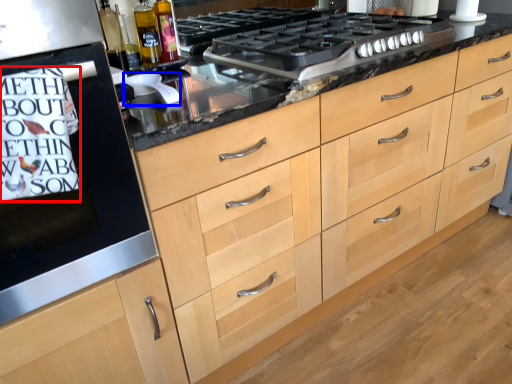
Question: Which of the following is the farthest to the observer, writing (highlighted by a red box) or appliance (highlighted by a blue box)?

Choices:
 (A) writing
 (B) appliance

Answer: (B)